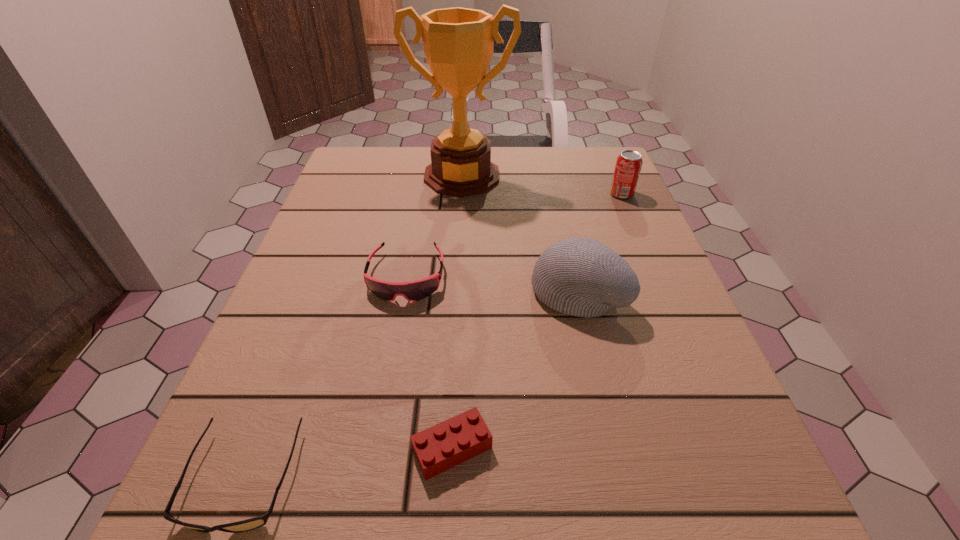
This screenshot has width=960, height=540. In the image, there is a desktop. Find the location of `blank space at the near left corner`. blank space at the near left corner is located at coordinates (204, 535).

In the image, there is a desktop. Where is `vacant region at the far right corner`? vacant region at the far right corner is located at coordinates (570, 174).

Where is `free space that is in between the Lego and the rightmost object`? This screenshot has width=960, height=540. free space that is in between the Lego and the rightmost object is located at coordinates point(537,321).

What are the coordinates of `vacant point located between the Lego and the soda can` in the screenshot? It's located at (537, 321).

Identify the location of vacant region between the Lego and the goggles. The height and width of the screenshot is (540, 960). (429, 362).

At what (x,y) coordinates should I click in order to perform the action: click on free space between the beanie and the goggles. Please return your answer as a coordinate pair (x, y). The width and height of the screenshot is (960, 540). Looking at the image, I should click on (492, 284).

Identify the location of free space between the rightmost object and the third shortest object. This screenshot has width=960, height=540. [514, 235].

This screenshot has width=960, height=540. Identify the location of free space between the rightmost object and the award. (541, 185).

Locate an element on the screen. The width and height of the screenshot is (960, 540). free space between the Lego and the goggles is located at coordinates (429, 362).

Image resolution: width=960 pixels, height=540 pixels. In order to click on free space between the Lego and the rightmost object in this screenshot , I will do `click(537, 321)`.